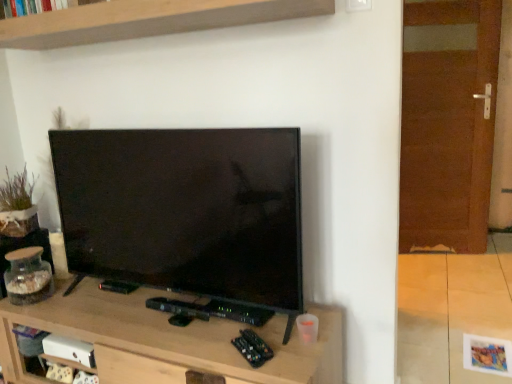
Question: Considering the relative sizes of brown wooden door at right and clear glass jar at left in the image provided, is brown wooden door at right thinner than clear glass jar at left?

Choices:
 (A) yes
 (B) no

Answer: (A)

Question: Does brown wooden door at right contain clear glass jar at left?

Choices:
 (A) yes
 (B) no

Answer: (B)

Question: Can you confirm if brown wooden door at right is taller than clear glass jar at left?

Choices:
 (A) yes
 (B) no

Answer: (A)

Question: Is clear glass jar at left at the back of brown wooden door at right?

Choices:
 (A) yes
 (B) no

Answer: (B)

Question: From the image's perspective, is brown wooden door at right on clear glass jar at left?

Choices:
 (A) no
 (B) yes

Answer: (B)

Question: Visually, is wooden tv stand at center positioned to the left or to the right of clear glass jar at left?

Choices:
 (A) left
 (B) right

Answer: (B)

Question: Is wooden tv stand at center bigger or smaller than clear glass jar at left?

Choices:
 (A) small
 (B) big

Answer: (B)

Question: From a real-world perspective, relative to clear glass jar at left, is wooden tv stand at center vertically above or below?

Choices:
 (A) above
 (B) below

Answer: (B)

Question: Is wooden tv stand at center wider or thinner than clear glass jar at left?

Choices:
 (A) thin
 (B) wide

Answer: (B)

Question: Considering the relative positions of clear glass jar at left and wooden shelf at upper center in the image provided, is clear glass jar at left to the left or to the right of wooden shelf at upper center?

Choices:
 (A) left
 (B) right

Answer: (A)

Question: Considering their positions, is clear glass jar at left located in front of or behind wooden shelf at upper center?

Choices:
 (A) front
 (B) behind

Answer: (B)

Question: In terms of width, does clear glass jar at left look wider or thinner when compared to wooden shelf at upper center?

Choices:
 (A) wide
 (B) thin

Answer: (B)

Question: Is clear glass jar at left taller or shorter than wooden shelf at upper center?

Choices:
 (A) tall
 (B) short

Answer: (B)

Question: Does point (418, 183) appear closer or farther from the camera than point (45, 268)?

Choices:
 (A) farther
 (B) closer

Answer: (A)

Question: From their relative heights in the image, would you say brown wooden door at right is taller or shorter than clear glass jar at left?

Choices:
 (A) short
 (B) tall

Answer: (B)